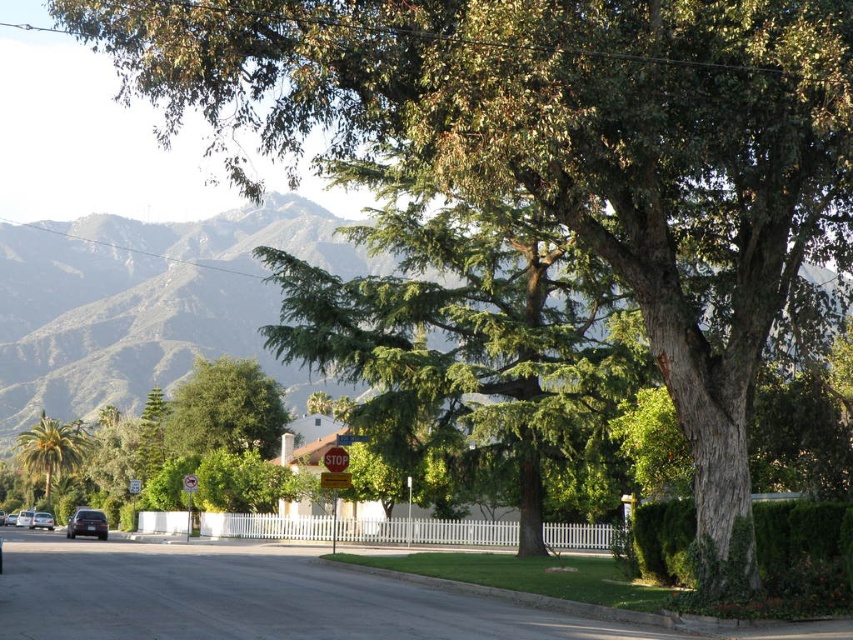
Question: Is shiny black sedan at lower left bigger than metallic reflective stop sign at center?

Choices:
 (A) no
 (B) yes

Answer: (A)

Question: Which is farther from the green leafy palm tree at left?

Choices:
 (A) green leafy mountain at upper center
 (B) metallic reflective stop sign at center

Answer: (B)

Question: Which point appears closest to the camera in this image?

Choices:
 (A) (51, 524)
 (B) (21, 509)
 (C) (228, 378)

Answer: (C)

Question: Which object is the farthest from the metallic stop sign at center?

Choices:
 (A) green leafy palm tree at left
 (B) metallic reflective stop sign at center
 (C) silver metallic car at lower left

Answer: (A)

Question: Is green leafy palm tree at left below metallic stop sign at center?

Choices:
 (A) yes
 (B) no

Answer: (A)

Question: Does shiny black sedan at lower left have a lesser width compared to metallic reflective stop sign at center?

Choices:
 (A) no
 (B) yes

Answer: (B)